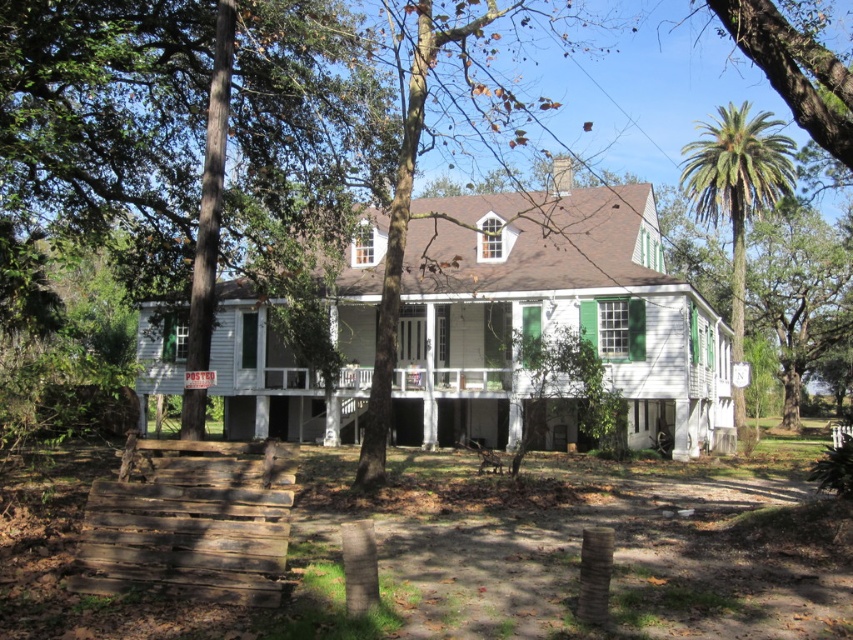
Measure the distance between point (320, 28) and camera.

A distance of 61.30 feet exists between point (320, 28) and camera.

Who is taller, green leafy tree at left or green wood tree at center?

green wood tree at center

Between point (57, 17) and point (430, 60), which one is positioned in front?

Positioned in front is point (57, 17).

Where is `green leafy tree at left`? green leafy tree at left is located at coordinates (107, 124).

Is green leafy tree at left positioned behind green leafy palm tree at right?

No, it is in front of green leafy palm tree at right.

The width and height of the screenshot is (853, 640). What do you see at coordinates (107, 124) in the screenshot?
I see `green leafy tree at left` at bounding box center [107, 124].

I want to click on green leafy tree at left, so click(107, 124).

What do you see at coordinates (190, 522) in the screenshot? This screenshot has height=640, width=853. I see `weathered brown wood at lower left` at bounding box center [190, 522].

Between point (271, 564) and point (395, 337), which one is positioned in front?

Point (271, 564) is more forward.

You are a GUI agent. You are given a task and a screenshot of the screen. Output one action in this format:
    pyautogui.click(x=<x>, y=<y>)
    Task: Click on the weathered brown wood at lower left
    This screenshot has height=640, width=853.
    Given the screenshot: What is the action you would take?
    pyautogui.click(x=190, y=522)